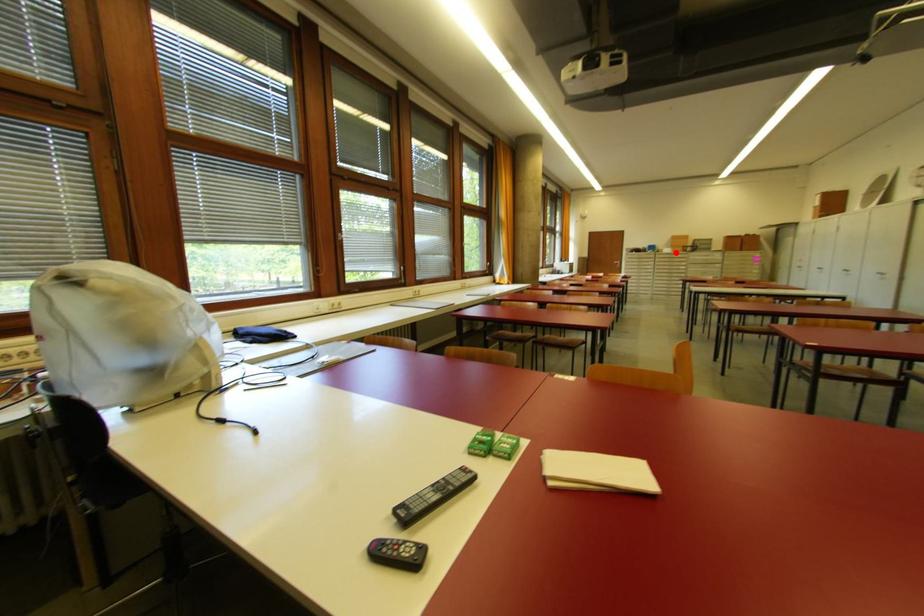
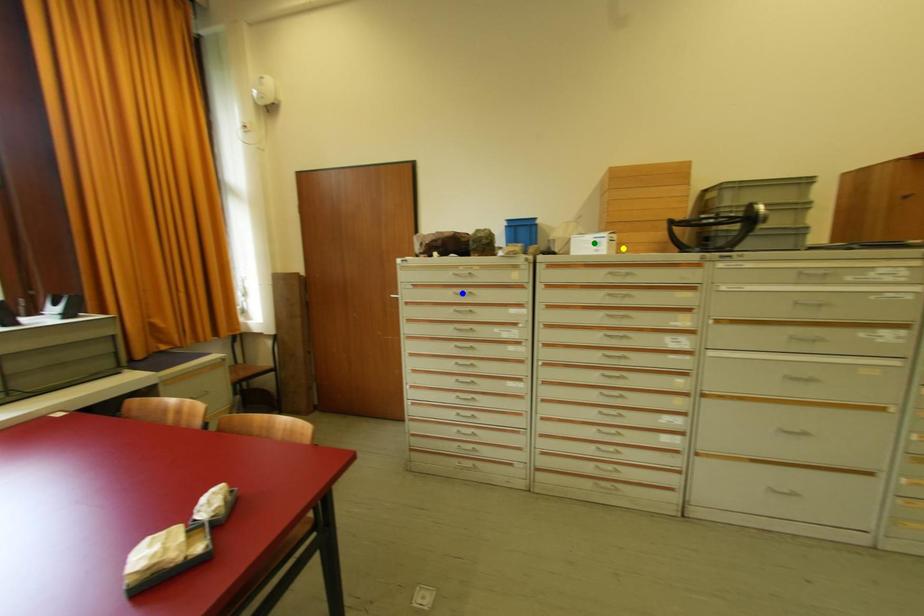
Question: I am providing you with two images of the same scene from different viewpoints. A red point is marked on the first image. You are given multiple points on the second image. Which mark in image 2 goes with the point in image 1?

Choices:
 (A) yellow point
 (B) blue point
 (C) green point

Answer: (A)